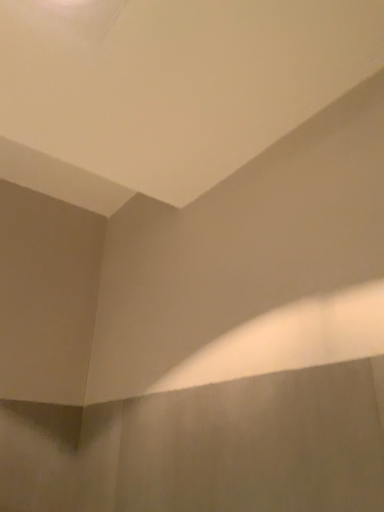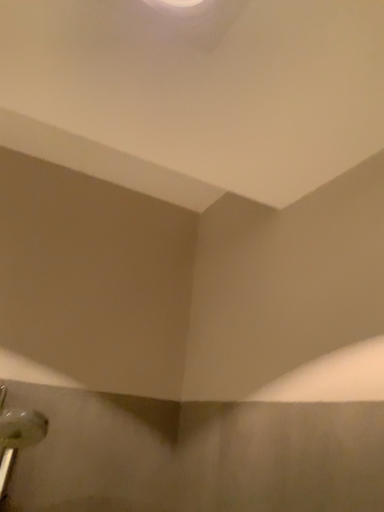
Question: Which way did the camera rotate in the video?

Choices:
 (A) rotated right
 (B) rotated left

Answer: (B)